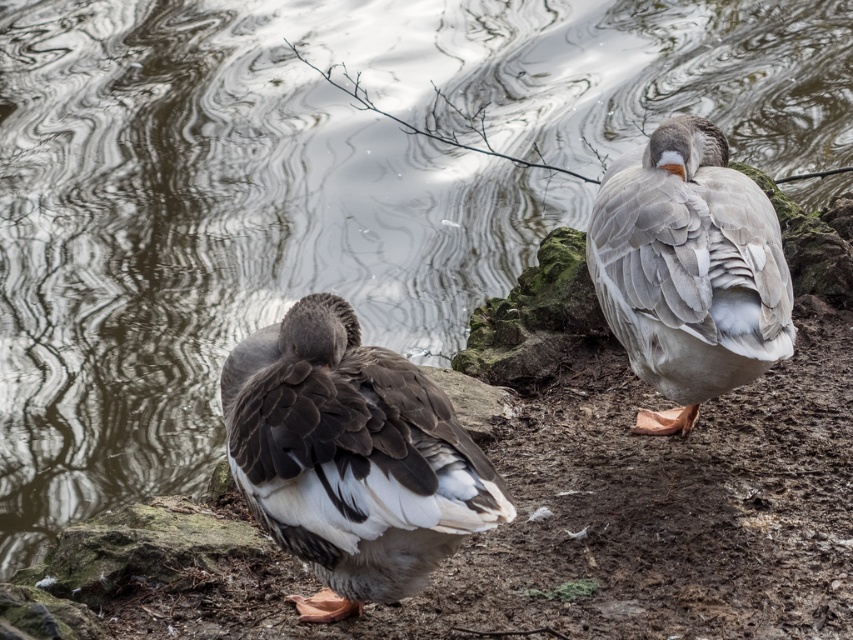
You are a wildlife photographer trying to capture both the brown feathered duck at center and the gray feathered goose at right in a single frame. Based on their positions, which bird is positioned closer to the camera?

The brown feathered duck at center is positioned closer to the camera than the gray feathered goose at right because it is at the center, which typically indicates a more central and closer position in such scenes.

You are a birdwatcher trying to identify the tallest bird between the brown feathered duck at center and the gray feathered goose at right. Which one is taller?

The gray feathered goose at right is taller than the brown feathered duck at center.

You are a birdwatcher observing the scene from the edge of the water. You see the brown feathered duck at center and the gray feathered goose at right. Which bird is positioned lower in the image?

The brown feathered duck at center is positioned below the gray feathered goose at right, so it is lower in the image.